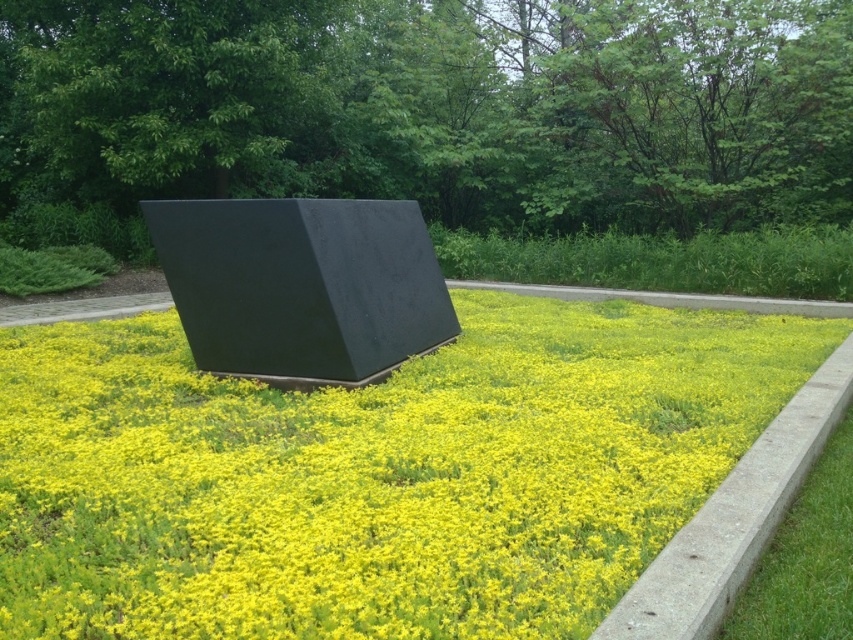
You are a gardener planning to plant a new flower bed. You want to place a decorative stone exactly at the center of the yellow matte flower at center. According to the image, what are the coordinates where you should place the stone?

The coordinates for placing the decorative stone at the center of the yellow matte flower at center are exactly at point (373, 474) as stated in the description.